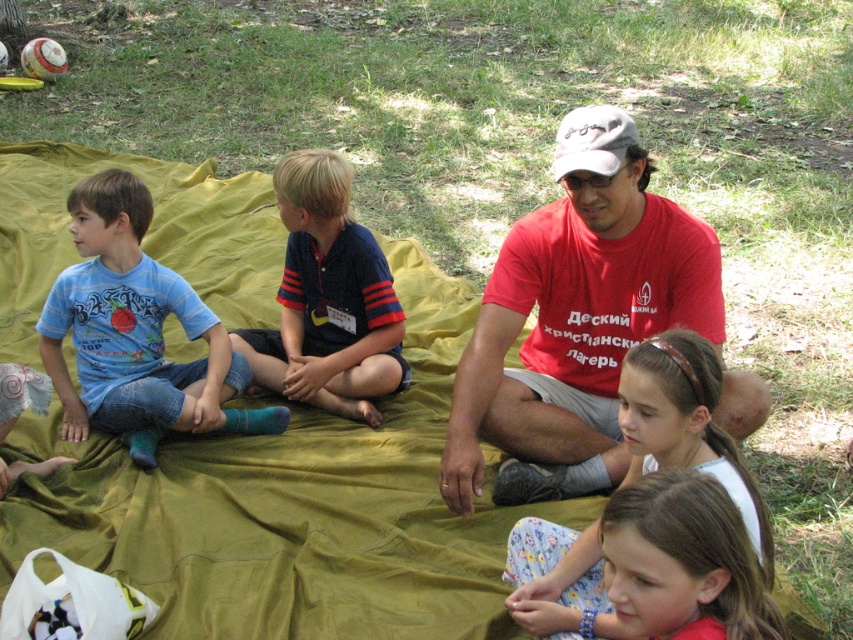
Question: Is blue denim jeans at left smaller than floral fabric pants at lower center?

Choices:
 (A) no
 (B) yes

Answer: (B)

Question: Which of the following is the farthest from the observer?

Choices:
 (A) blue denim jeans at left
 (B) gray fabric baseball cap at center
 (C) floral fabric pants at lower center

Answer: (A)

Question: Is blue striped polo shirt at center positioned at the back of floral fabric pants at lower center?

Choices:
 (A) no
 (B) yes

Answer: (B)

Question: Is blue striped polo shirt at center to the right of gray fabric baseball cap at center from the viewer's perspective?

Choices:
 (A) yes
 (B) no

Answer: (B)

Question: Which point is closer to the camera taking this photo?

Choices:
 (A) pos(363,228)
 (B) pos(672,429)
 (C) pos(592,179)
 (D) pos(164,365)

Answer: (B)

Question: Which point is farther to the camera?

Choices:
 (A) (303, 305)
 (B) (577, 176)
 (C) (590, 144)
 (D) (138, 404)

Answer: (A)